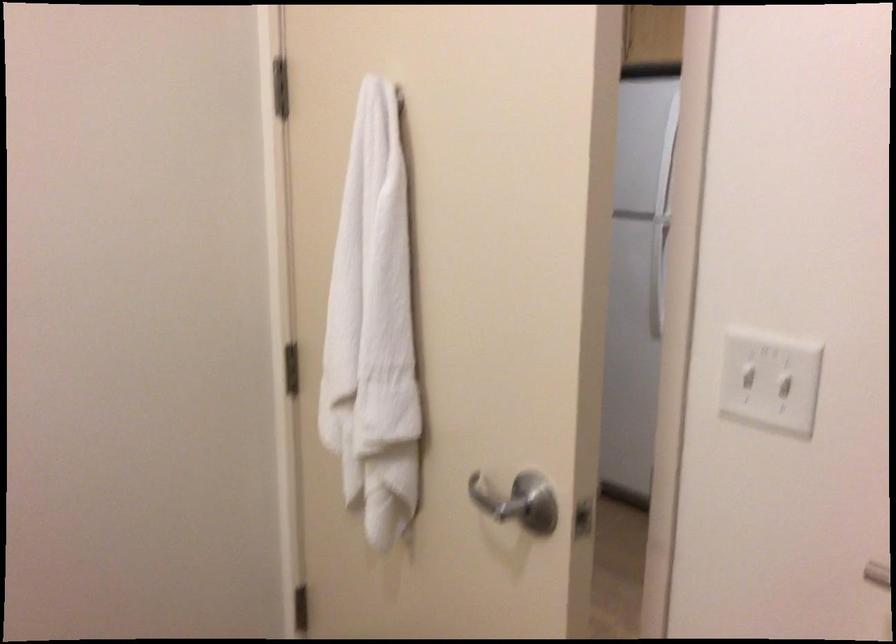
Where is `metal door handle`? This screenshot has width=896, height=644. metal door handle is located at coordinates (494, 500).